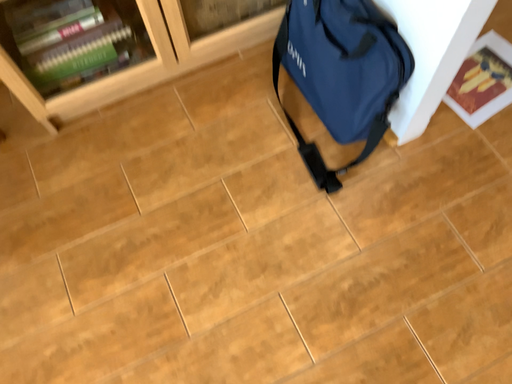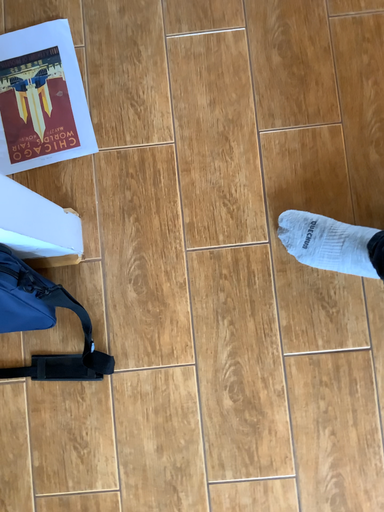
Question: How did the camera likely rotate when shooting the video?

Choices:
 (A) rotated right
 (B) rotated left

Answer: (A)